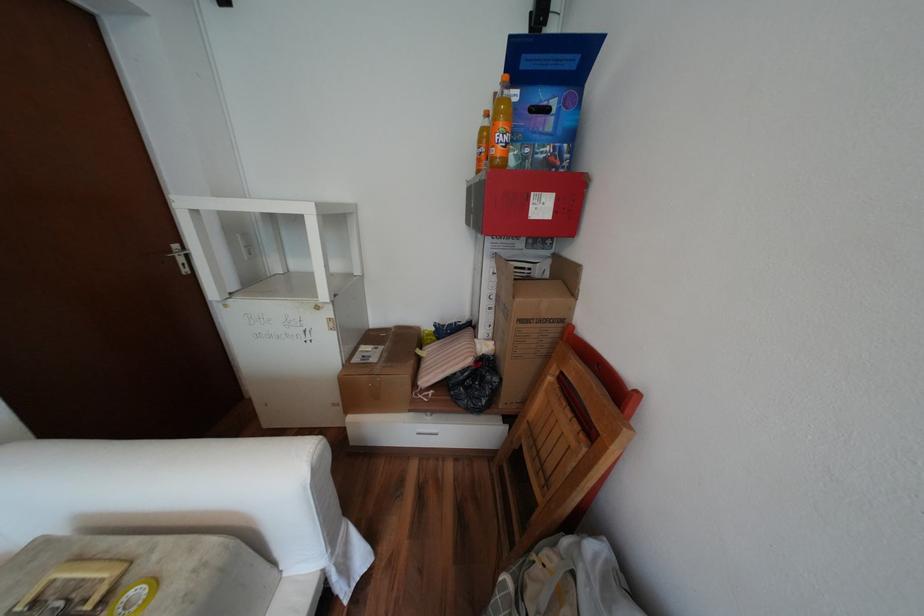
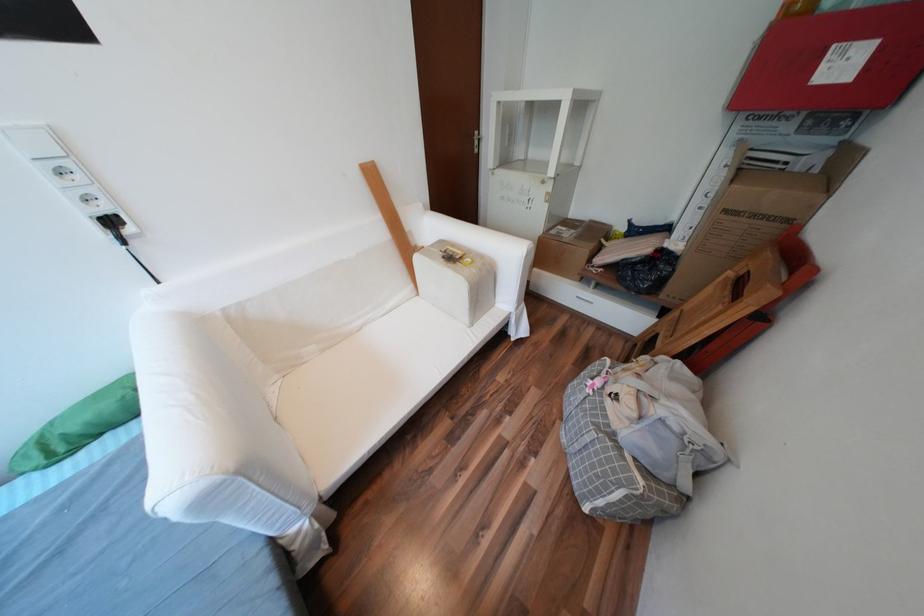
Locate, in the second image, the point that corresponds to (529,321) in the first image.

(736, 211)